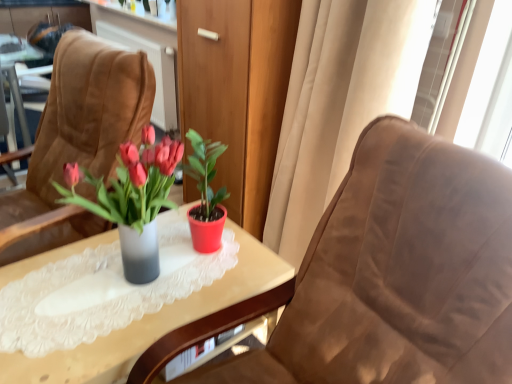
Identify the location of vacant space situated on the left part of matte plastic vase at center. The image size is (512, 384). (47, 277).